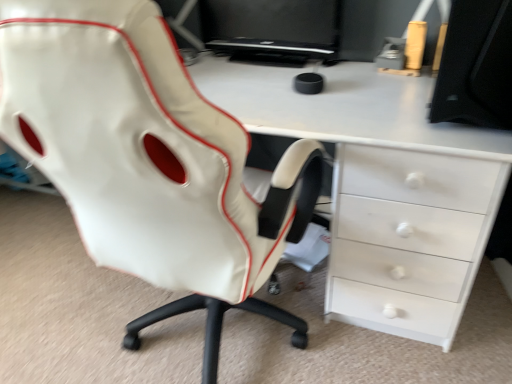
At what (x,y) coordinates should I click in order to perform the action: click on free spot below black glossy monitor at upper center (from a real-world perspective). Please return your answer as a coordinate pair (x, y). Image resolution: width=512 pixels, height=384 pixels. Looking at the image, I should click on (291, 64).